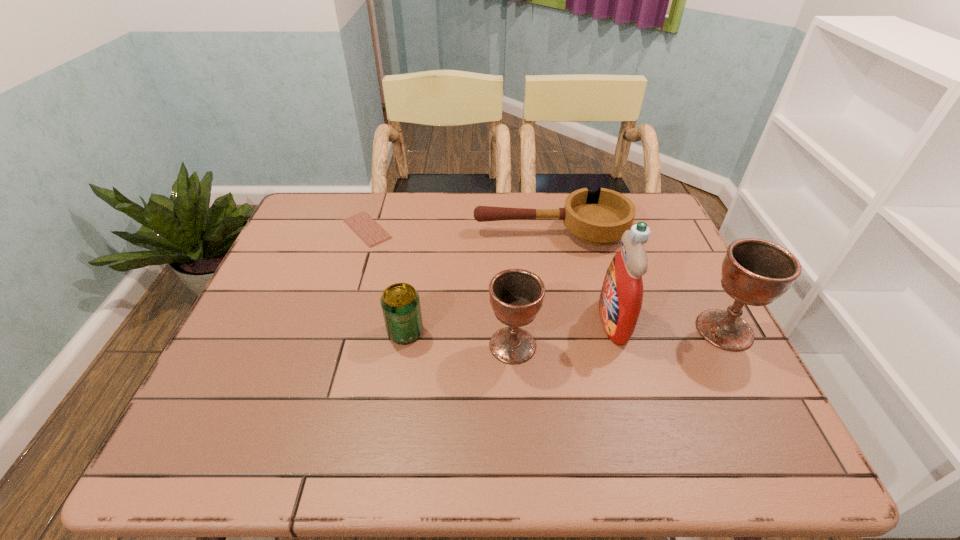
Identify the location of object that is the fourth closest to the saucepan. The height and width of the screenshot is (540, 960). (516, 296).

Where is `object that is the fourth closest one to the detergent`? object that is the fourth closest one to the detergent is located at coordinates (400, 302).